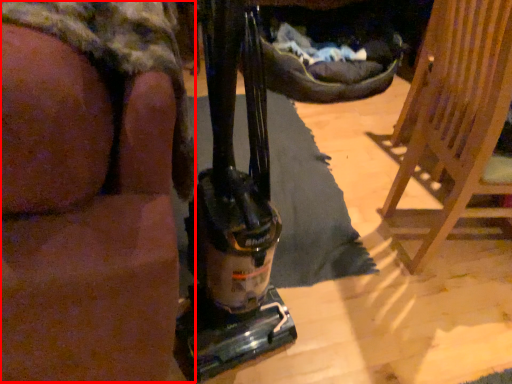
Question: From the image's perspective, what is the correct spatial positioning of person (annotated by the red box) in reference to furniture?

Choices:
 (A) below
 (B) above

Answer: (B)